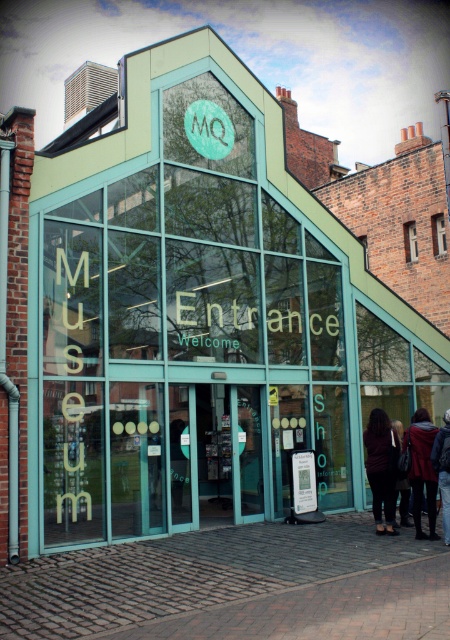
I want to click on dark brown leather jacket at lower center, so click(x=382, y=467).

The width and height of the screenshot is (450, 640). What are the coordinates of `dark brown leather jacket at lower center` in the screenshot? It's located at (382, 467).

Is point (422, 467) positioned after point (409, 253)?

No, (422, 467) is closer to viewer.

The width and height of the screenshot is (450, 640). In order to click on dark brown leather jacket at center in this screenshot , I will do `click(422, 468)`.

Is point (414, 444) behind point (444, 241)?

No.

Between dark brown leather jacket at center and clear glass window at center, which one appears on the right side from the viewer's perspective?

clear glass window at center is more to the right.

Who is more forward, (427, 486) or (439, 240)?

Point (427, 486)

Where is `dark brown leather jacket at center`? This screenshot has width=450, height=640. dark brown leather jacket at center is located at coordinates (422, 468).